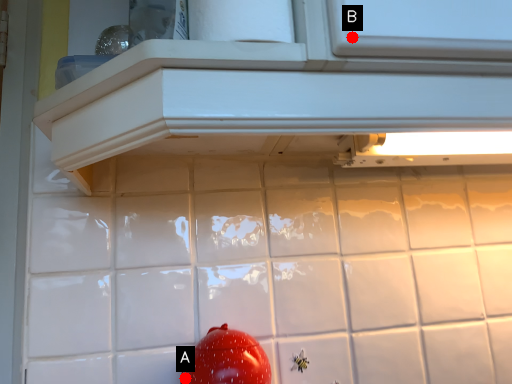
Question: Two points are circled on the image, labeled by A and B beside each circle. Which point is further to the camera?

Choices:
 (A) A is further
 (B) B is further

Answer: (A)